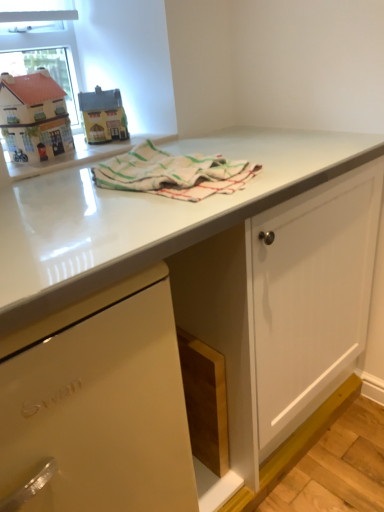
What do you see at coordinates (173, 173) in the screenshot?
I see `white striped cloth at center` at bounding box center [173, 173].

Where is `clear glass window screen at upper left`? clear glass window screen at upper left is located at coordinates (41, 44).

From a real-world perspective, who is located lower, white striped cloth at center or matte plastic toy house at upper left?

In real-world perspective, white striped cloth at center is lower.

Considering the positions of objects white striped cloth at center and matte plastic toy house at upper left in the image provided, who is in front, white striped cloth at center or matte plastic toy house at upper left?

white striped cloth at center is more forward.

From the image's perspective, is white striped cloth at center located above or below matte plastic toy house at upper left?

Based on their image positions, white striped cloth at center is located beneath matte plastic toy house at upper left.

Is the surface of white striped cloth at center in direct contact with matte plastic toy house at upper left?

No, white striped cloth at center is not beside matte plastic toy house at upper left.

Considering the sizes of matte white dishwasher at lower left and matte plastic toy house at upper left in the image, is matte white dishwasher at lower left wider or thinner than matte plastic toy house at upper left?

Considering their sizes, matte white dishwasher at lower left looks broader than matte plastic toy house at upper left.

Is matte white dishwasher at lower left not close to matte plastic toy house at upper left?

No, matte white dishwasher at lower left is not far away from matte plastic toy house at upper left.

Considering the sizes of matte white dishwasher at lower left and matte plastic toy house at upper left in the image, is matte white dishwasher at lower left bigger or smaller than matte plastic toy house at upper left?

Clearly, matte white dishwasher at lower left is larger in size than matte plastic toy house at upper left.

Is matte white dishwasher at lower left situated inside matte plastic toy house at upper left or outside?

matte white dishwasher at lower left exists outside the volume of matte plastic toy house at upper left.

This screenshot has width=384, height=512. I want to click on window screen above the matte plastic toy house at upper left (from the image's perspective), so click(x=41, y=44).

From a real-world perspective, relative to clear glass window screen at upper left, is matte plastic toy house at upper left vertically above or below?

Clearly, from a real-world perspective, matte plastic toy house at upper left is below clear glass window screen at upper left.

Does matte plastic toy house at upper left have a lesser width compared to clear glass window screen at upper left?

Incorrect, the width of matte plastic toy house at upper left is not less than that of clear glass window screen at upper left.

Does point (123, 170) lie in front of point (163, 276)?

No, it is behind (163, 276).

What's the angular difference between white striped cloth at center and matte white dishwasher at lower left's facing directions?

white striped cloth at center and matte white dishwasher at lower left are facing 0.103 degrees away from each other.

In terms of width, does white striped cloth at center look wider or thinner when compared to matte white dishwasher at lower left?

white striped cloth at center is thinner than matte white dishwasher at lower left.

Measure the distance between white striped cloth at center and matte white dishwasher at lower left.

white striped cloth at center is 16.44 inches from matte white dishwasher at lower left.

Which is more to the left, clear glass window screen at upper left or white striped cloth at center?

From the viewer's perspective, clear glass window screen at upper left appears more on the left side.

In the scene shown: Is clear glass window screen at upper left surrounding white striped cloth at center?

That's incorrect, white striped cloth at center is not inside clear glass window screen at upper left.

Is white striped cloth at center at the back of clear glass window screen at upper left?

No, clear glass window screen at upper left is not facing the opposite direction of white striped cloth at center.

From the picture: Between clear glass window screen at upper left and white striped cloth at center, which one is positioned in front?

white striped cloth at center is closer to the camera.

This screenshot has height=512, width=384. In order to click on cabinetry below the white striped cloth at center (from the image's perspective) in this screenshot , I will do `click(99, 405)`.

Is matte white dishwasher at lower left facing towards white striped cloth at center?

No, matte white dishwasher at lower left does not turn towards white striped cloth at center.

Which is further, (36, 405) or (150, 153)?

Point (150, 153)

Between clear glass window screen at upper left and matte white dishwasher at lower left, which one has larger size?

With larger size is matte white dishwasher at lower left.

Where is `window screen above the matte white dishwasher at lower left (from the image's perspective)`? window screen above the matte white dishwasher at lower left (from the image's perspective) is located at coordinates click(x=41, y=44).

Is clear glass window screen at upper left positioned with its back to matte white dishwasher at lower left?

No, clear glass window screen at upper left's orientation is not away from matte white dishwasher at lower left.

You are a GUI agent. You are given a task and a screenshot of the screen. Output one action in this format:
    pyautogui.click(x=<x>, y=<y>)
    Task: Click on the appliance on the left of white striped cloth at center
    
    Given the screenshot: What is the action you would take?
    pyautogui.click(x=103, y=116)

In the image, there is a matte plastic toy house at upper left. Find the location of `cabinetry below it (from a real-world perspective)`. cabinetry below it (from a real-world perspective) is located at coordinates 99,405.

In the scene shown: Estimate the real-world distances between objects in this image. Which object is further from matte plastic toy house at upper left, white striped cloth at center or clear glass window screen at upper left?

white striped cloth at center is further to matte plastic toy house at upper left.

Estimate the real-world distances between objects in this image. Which object is further from clear glass window screen at upper left, matte white dishwasher at lower left or white striped cloth at center?

matte white dishwasher at lower left.

Based on their spatial positions, is matte plastic toy house at upper left or matte white dishwasher at lower left further from white striped cloth at center?

matte plastic toy house at upper left lies further to white striped cloth at center than the other object.

Estimate the real-world distances between objects in this image. Which object is closer to white striped cloth at center, matte white dishwasher at lower left or matte plastic toy house at upper left?

Based on the image, matte white dishwasher at lower left appears to be nearer to white striped cloth at center.

From the image, which object appears to be nearer to matte white dishwasher at lower left, clear glass window screen at upper left or matte plastic toy house at upper left?

matte plastic toy house at upper left is positioned closer to the anchor matte white dishwasher at lower left.

Estimate the real-world distances between objects in this image. Which object is further from white striped cloth at center, matte white dishwasher at lower left or clear glass window screen at upper left?

The object further to white striped cloth at center is clear glass window screen at upper left.

Which object lies nearer to the anchor point matte plastic toy house at upper left, clear glass window screen at upper left or matte white dishwasher at lower left?

clear glass window screen at upper left lies closer to matte plastic toy house at upper left than the other object.

Which object lies further to the anchor point matte plastic toy house at upper left, matte white dishwasher at lower left or white striped cloth at center?

matte white dishwasher at lower left lies further to matte plastic toy house at upper left than the other object.

In order to click on window screen located between white striped cloth at center and matte plastic toy house at upper left in the depth direction in this screenshot , I will do `click(41, 44)`.

Where is `appliance between clear glass window screen at upper left and matte white dishwasher at lower left from top to bottom`? appliance between clear glass window screen at upper left and matte white dishwasher at lower left from top to bottom is located at coordinates (103, 116).

Locate an element on the screen. This screenshot has height=512, width=384. bath towel between matte plastic toy house at upper left and matte white dishwasher at lower left in the up-down direction is located at coordinates (173, 173).

The width and height of the screenshot is (384, 512). What are the coordinates of `bath towel between clear glass window screen at upper left and matte white dishwasher at lower left from top to bottom` in the screenshot? It's located at (173, 173).